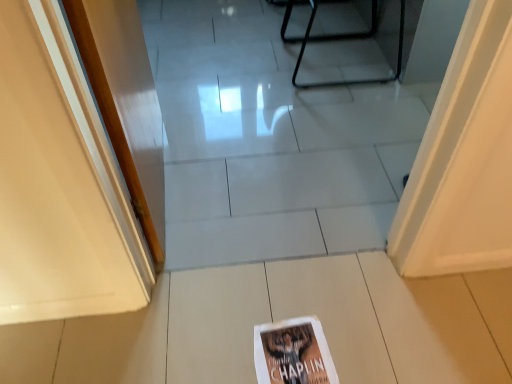
Locate an element on the screen. vacant region to the left of white paper book at center is located at coordinates (209, 345).